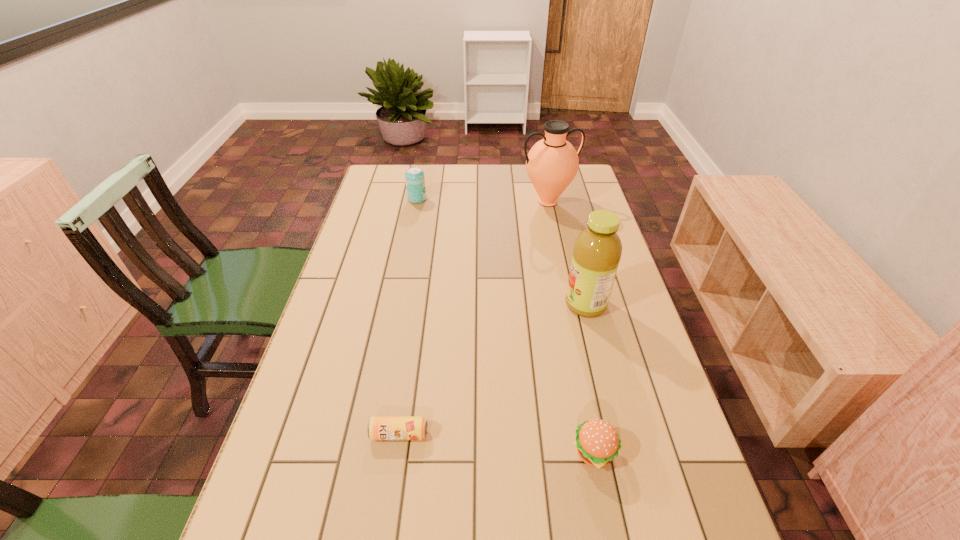
This screenshot has height=540, width=960. Find the location of `vacant space positioned 0.250m on the front label of the third farthest object`. vacant space positioned 0.250m on the front label of the third farthest object is located at coordinates (476, 305).

Where is `vacant space located on the left of the taller beer can`? vacant space located on the left of the taller beer can is located at coordinates (368, 199).

Locate an element on the screen. This screenshot has height=540, width=960. free spot located on the back of the second shortest object is located at coordinates (585, 402).

Identify the location of vacant space located 0.360m on the right of the shortest object. [593, 434].

You are a GUI agent. You are given a task and a screenshot of the screen. Output one action in this format:
    pyautogui.click(x=<x>, y=<y>)
    Task: Click on the pitcher at the far edge
    This screenshot has width=960, height=540.
    Given the screenshot: What is the action you would take?
    pyautogui.click(x=552, y=163)

Locate an element on the screen. The width and height of the screenshot is (960, 540). beer can present at the far edge is located at coordinates (415, 180).

Where is `pitcher positioned at the right edge`? The image size is (960, 540). pitcher positioned at the right edge is located at coordinates (552, 163).

The height and width of the screenshot is (540, 960). What are the coordinates of `fruit juice positioned at the right edge` in the screenshot? It's located at (597, 250).

At what (x,y) coordinates should I click in order to perform the action: click on hamburger located in the right edge section of the desktop. Please return your answer as a coordinate pair (x, y). This screenshot has height=540, width=960. Looking at the image, I should click on (597, 442).

Find the location of `object situated at the far right corner`. object situated at the far right corner is located at coordinates (552, 163).